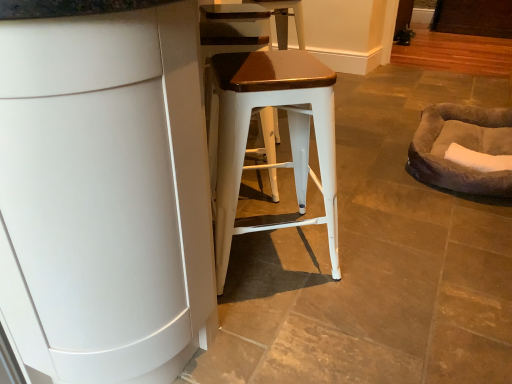
Question: From a real-world perspective, is white matte cabinet at center physically located above or below brown fuzzy bean bag at right?

Choices:
 (A) above
 (B) below

Answer: (A)

Question: Looking at their shapes, would you say white matte cabinet at center is wider or thinner than brown fuzzy bean bag at right?

Choices:
 (A) wide
 (B) thin

Answer: (A)

Question: Based on their relative distances, which object is nearer to the brown fuzzy bean bag at right?

Choices:
 (A) matte white stool at center
 (B) white matte cabinet at center

Answer: (A)

Question: Which is nearer to the matte white stool at center?

Choices:
 (A) brown fuzzy bean bag at right
 (B) white matte cabinet at center

Answer: (B)